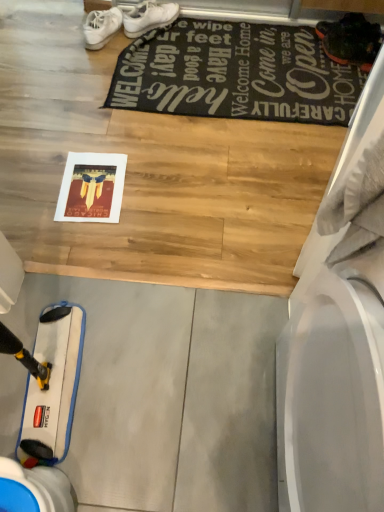
Question: Considering the relative positions of white matte sneakers at upper center and black fabric mat at upper center in the image provided, is white matte sneakers at upper center to the left or to the right of black fabric mat at upper center?

Choices:
 (A) left
 (B) right

Answer: (A)

Question: Looking at their shapes, would you say white matte sneakers at upper center is wider or thinner than black fabric mat at upper center?

Choices:
 (A) wide
 (B) thin

Answer: (B)

Question: Is white matte sneakers at upper center bigger or smaller than black fabric mat at upper center?

Choices:
 (A) small
 (B) big

Answer: (A)

Question: In the image, is black fabric mat at upper center on the left side or the right side of white matte sneakers at upper center?

Choices:
 (A) right
 (B) left

Answer: (A)

Question: From a real-world perspective, is black fabric mat at upper center above or below white matte sneakers at upper center?

Choices:
 (A) below
 (B) above

Answer: (A)

Question: In terms of width, does black fabric mat at upper center look wider or thinner when compared to white matte sneakers at upper center?

Choices:
 (A) thin
 (B) wide

Answer: (B)

Question: Is point (319, 31) closer or farther from the camera than point (109, 31)?

Choices:
 (A) closer
 (B) farther

Answer: (B)